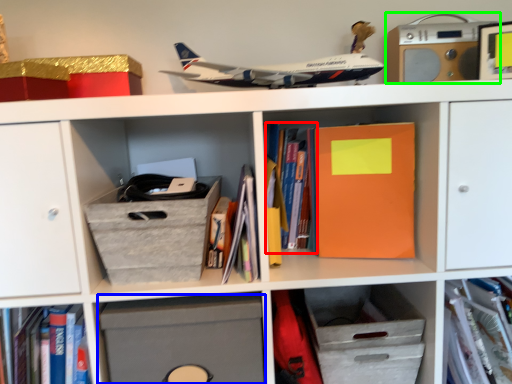
Question: Considering the real-world distances, which object is farthest from book (highlighted by a red box)? cabinet (highlighted by a blue box) or stereo (highlighted by a green box)?

Choices:
 (A) cabinet
 (B) stereo

Answer: (B)